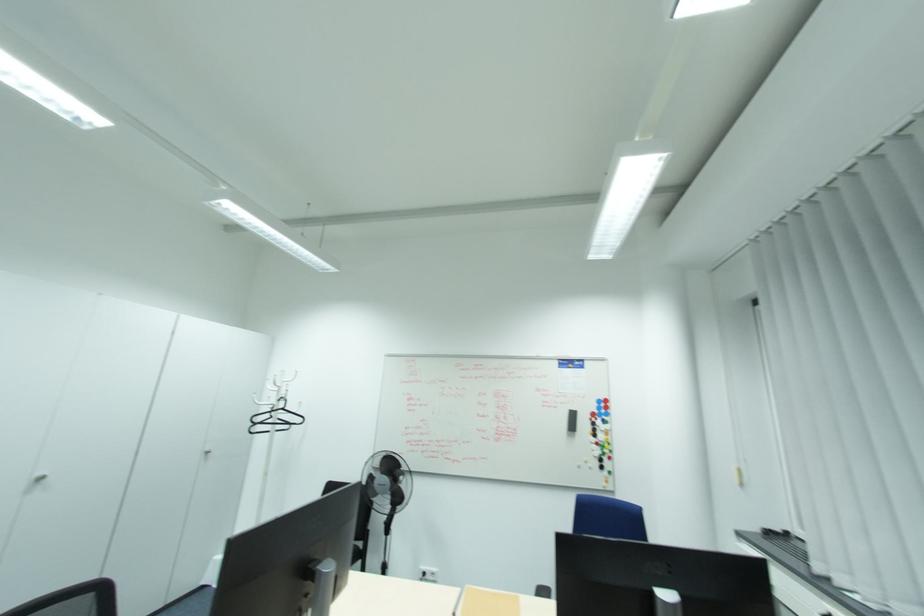
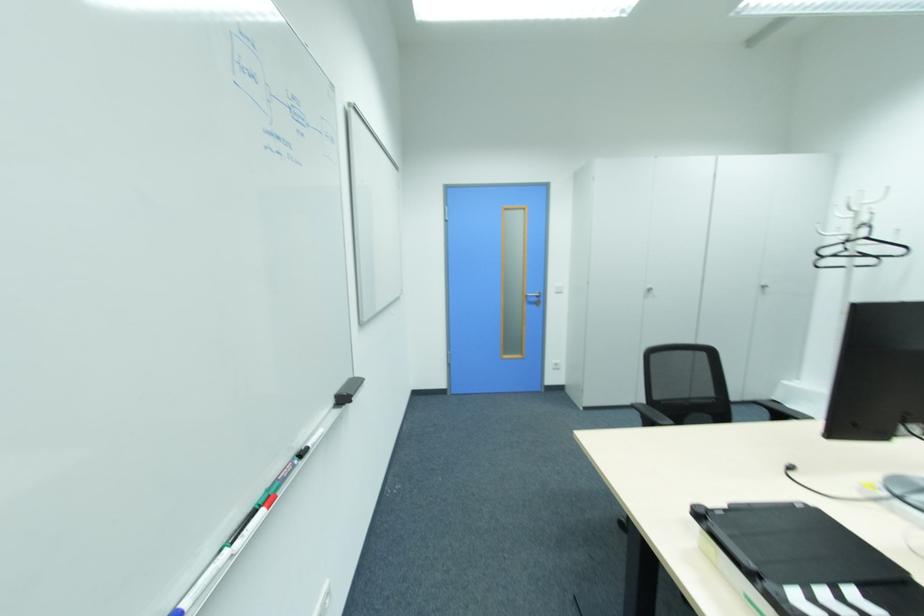
Question: The camera is either moving clockwise (left) or counter-clockwise (right) around the object. The first image is from the beginning of the video and the second image is from the end. Is the camera moving left or right when shooting the video?

Choices:
 (A) Left
 (B) Right

Answer: (B)